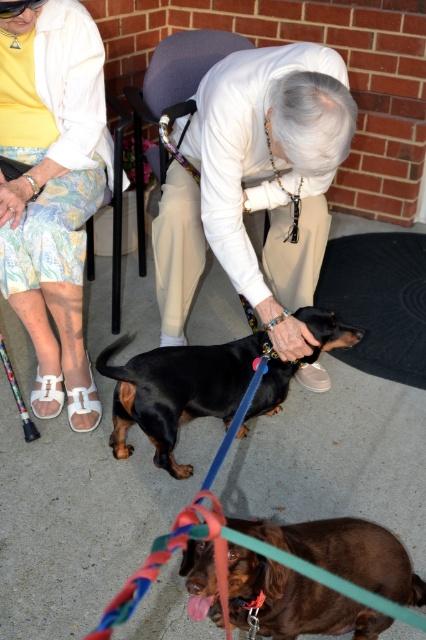
Is smooth black dog at center below black smooth dachshund at center?

Actually, smooth black dog at center is above black smooth dachshund at center.

What do you see at coordinates (256, 184) in the screenshot? This screenshot has width=426, height=640. I see `smooth black dog at center` at bounding box center [256, 184].

The image size is (426, 640). I want to click on smooth black dog at center, so [x=256, y=184].

Where is `white floral skirt at lower left`? The image size is (426, 640). white floral skirt at lower left is located at coordinates (51, 188).

Does point (54, 266) come closer to viewer compared to point (336, 602)?

No.

Based on the photo, measure the distance between white floral skirt at lower left and camera.

They are 5.28 feet apart.

The width and height of the screenshot is (426, 640). What are the coordinates of `white floral skirt at lower left` in the screenshot? It's located at tap(51, 188).

Is white floral skirt at lower left positioned at the back of black smooth dachshund at center?

That is False.

Does white floral skirt at lower left have a greater width compared to black smooth dachshund at center?

No.

Who is more forward, (32, 321) or (164, 392)?

Positioned in front is point (164, 392).

Find the location of a particular element. The width and height of the screenshot is (426, 640). white floral skirt at lower left is located at coordinates (51, 188).